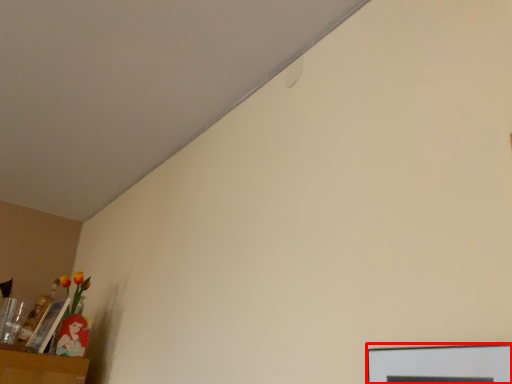
Question: From the image's perspective, considering the relative positions of picture frame (annotated by the red box) and picture frame in the image provided, where is picture frame (annotated by the red box) located with respect to the staircase?

Choices:
 (A) below
 (B) above

Answer: (B)